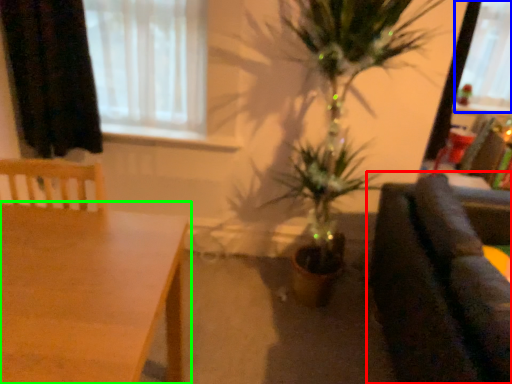
Question: Estimate the real-world distances between objects in this image. Which object is farther from studio couch (highlighted by a red box), window screen (highlighted by a blue box) or table (highlighted by a green box)?

Choices:
 (A) window screen
 (B) table

Answer: (A)